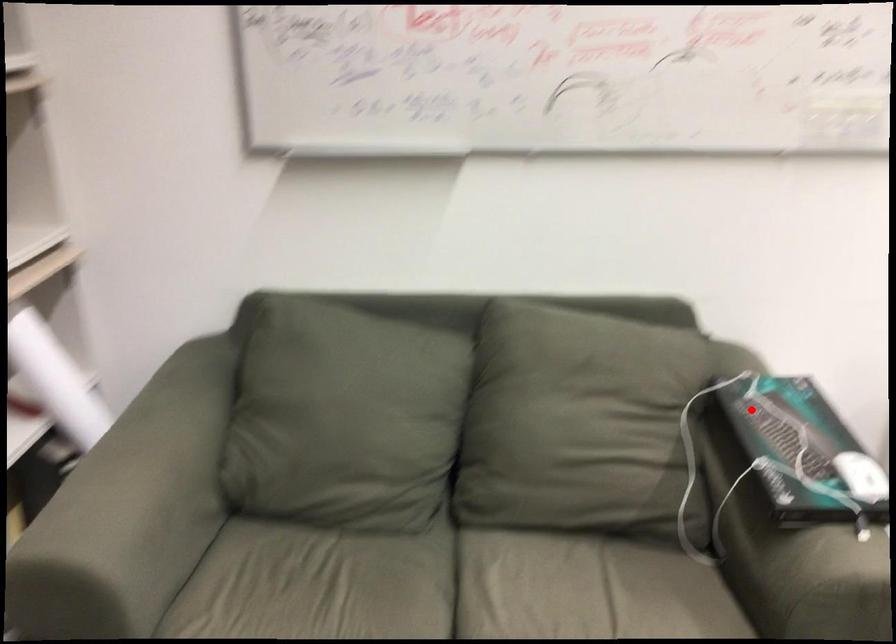
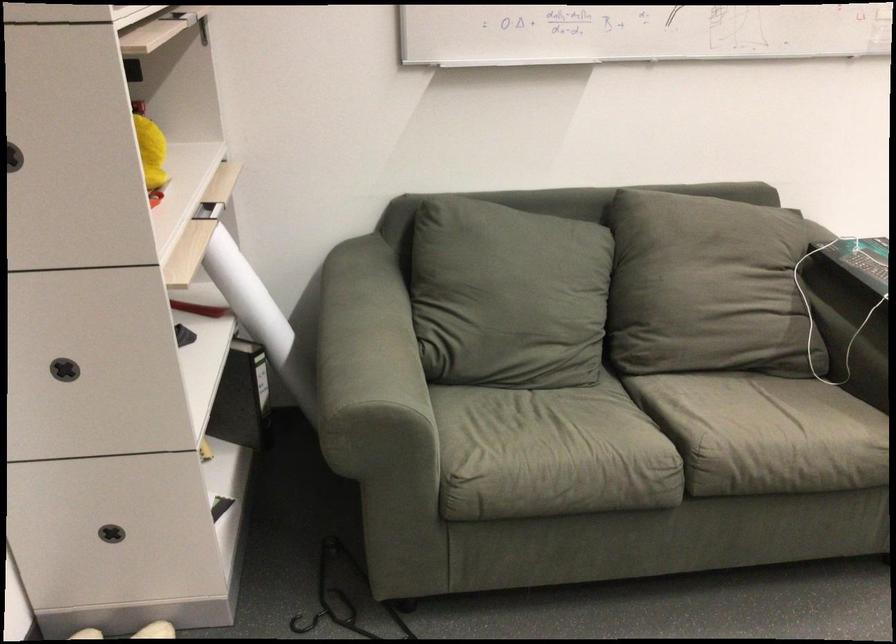
Question: A red point is marked in image1. In image2, is the corresponding 3D point closer to the camera or farther? Reply with the corresponding letter.

Choices:
 (A) The corresponding 3D point is closer.
 (B) The corresponding 3D point is farther.

Answer: (B)